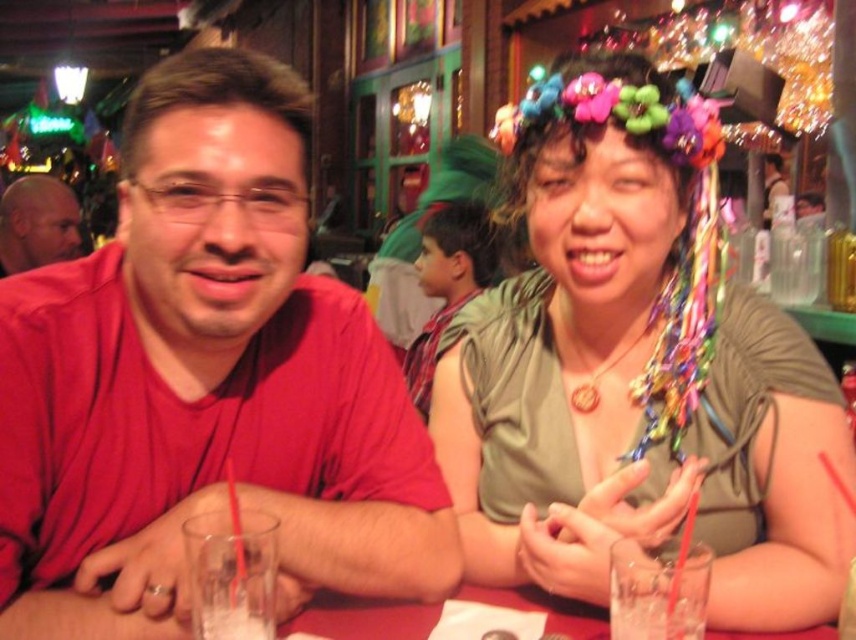
Question: Can you confirm if green matte shirt at center is positioned to the right of clear glass at lower left?

Choices:
 (A) no
 (B) yes

Answer: (B)

Question: Which object is farther from the camera taking this photo?

Choices:
 (A) green matte shirt at center
 (B) bald head at left
 (C) translucent glass at lower right
 (D) matte red shirt at left

Answer: (B)

Question: Does matte red shirt at left appear on the left side of clear glass at lower left?

Choices:
 (A) yes
 (B) no

Answer: (A)

Question: Which of the following is the closest to the observer?

Choices:
 (A) (24, 243)
 (B) (703, 108)

Answer: (B)

Question: Which point appears closest to the camera in this image?

Choices:
 (A) (431, 292)
 (B) (663, 612)
 (C) (52, 177)

Answer: (B)

Question: Does matte red shirt at left appear on the left side of green matte shirt at center?

Choices:
 (A) yes
 (B) no

Answer: (A)